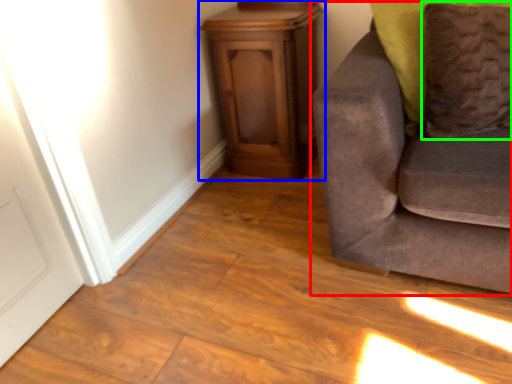
Question: Which is farther away from studio couch (highlighted by a red box)? furniture (highlighted by a blue box) or pillow (highlighted by a green box)?

Choices:
 (A) furniture
 (B) pillow

Answer: (A)